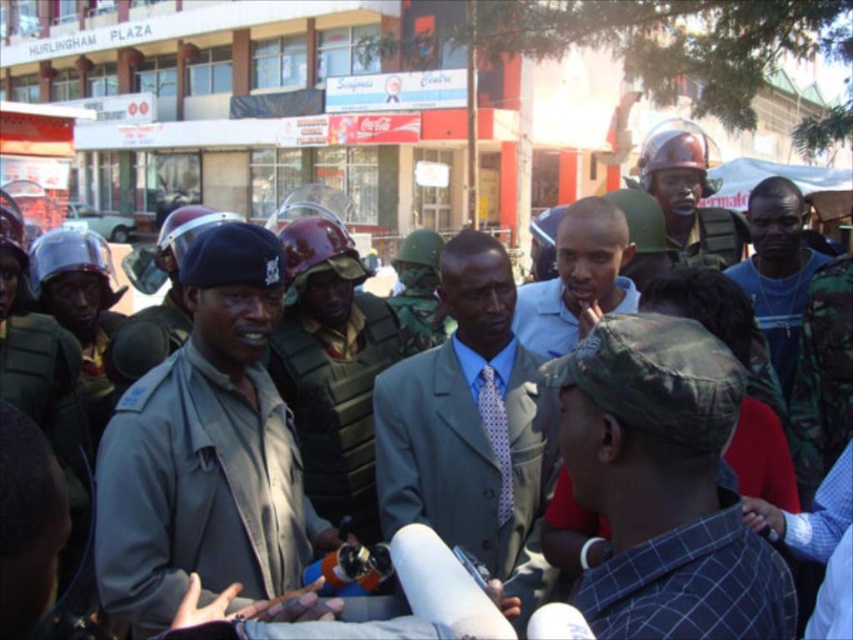
Question: Which point is closer to the camera?

Choices:
 (A) light blue shirt at center
 (B) camouflage uniform at center

Answer: (A)

Question: Does camo hat at center have a smaller size compared to light gray suit at center?

Choices:
 (A) yes
 (B) no

Answer: (A)

Question: Is camo hat at center below camouflage uniform at center?

Choices:
 (A) no
 (B) yes

Answer: (B)

Question: Which of the following is the closest to the observer?

Choices:
 (A) light gray suit at center
 (B) gray uniformed officer at center

Answer: (A)

Question: Which object appears farthest from the camera in this image?

Choices:
 (A) camo hat at center
 (B) gray uniformed officer at center

Answer: (B)

Question: Can you confirm if light gray suit at center is positioned below light blue shirt at center?

Choices:
 (A) no
 (B) yes

Answer: (B)